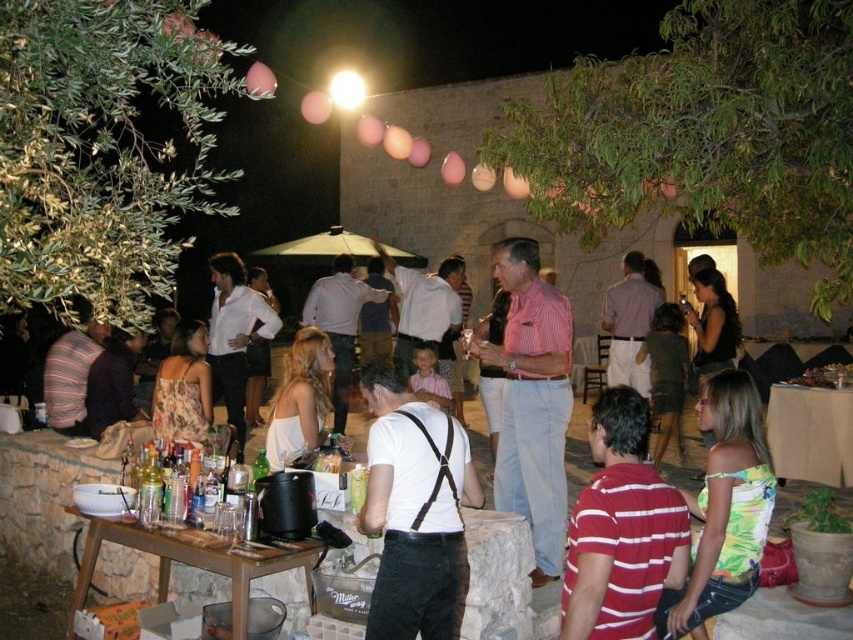
Question: Is pink checkered shirt at center bigger than brown wooden table at lower left?

Choices:
 (A) no
 (B) yes

Answer: (B)

Question: Which object is farther from the camera taking this photo?

Choices:
 (A) white cardboard table at center
 (B) striped cotton shirt at center

Answer: (A)

Question: Which point appears closest to the camera in this image?

Choices:
 (A) (175, 545)
 (B) (405, 620)
 (C) (738, 518)
 (D) (844, 436)

Answer: (B)

Question: Which point is closer to the camera?

Choices:
 (A) green floral tank top at lower right
 (B) brown wooden table at lower left
 (C) white cardboard table at center
 (D) striped cotton shirt at center

Answer: (D)

Question: Does striped cotton shirt at center have a smaller size compared to white fabric dress at center?

Choices:
 (A) no
 (B) yes

Answer: (B)

Question: Can you confirm if brown wooden table at lower left is positioned below white cardboard table at center?

Choices:
 (A) no
 (B) yes

Answer: (B)